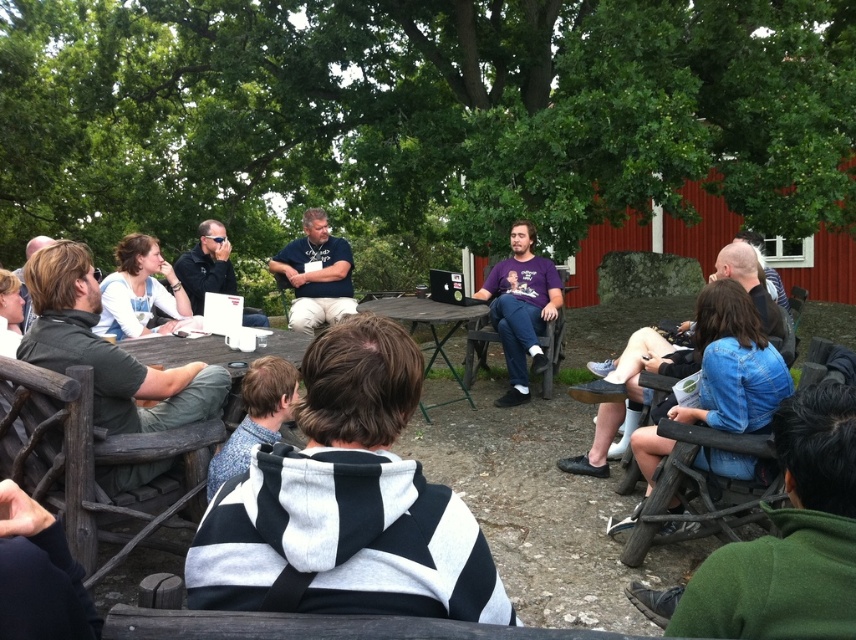
Does point (740, 387) come behind point (522, 310)?

No, it is in front of (522, 310).

Where is `blue denim jeans at lower right`? blue denim jeans at lower right is located at coordinates (733, 364).

Is point (46, 262) farther from camera compared to point (519, 321)?

No, it is not.

Locate an element on the screen. The width and height of the screenshot is (856, 640). dark green shirt at left is located at coordinates (108, 349).

Looking at this image, measure the distance between dark green shirt at left and camera.

dark green shirt at left is 2.50 meters away from camera.

This screenshot has height=640, width=856. What are the coordinates of `dark green shirt at left` in the screenshot? It's located at (108, 349).

How much distance is there between blue denim jeans at lower right and wooden picnic table at center?

They are 2.41 meters apart.

Does blue denim jeans at lower right appear on the left side of wooden picnic table at center?

Incorrect, blue denim jeans at lower right is not on the left side of wooden picnic table at center.

At what (x,y) coordinates should I click in order to perform the action: click on blue denim jeans at lower right. Please return your answer as a coordinate pair (x, y). Image resolution: width=856 pixels, height=640 pixels. Looking at the image, I should click on (733, 364).

Locate an element on the screen. The image size is (856, 640). blue denim jeans at lower right is located at coordinates (733, 364).